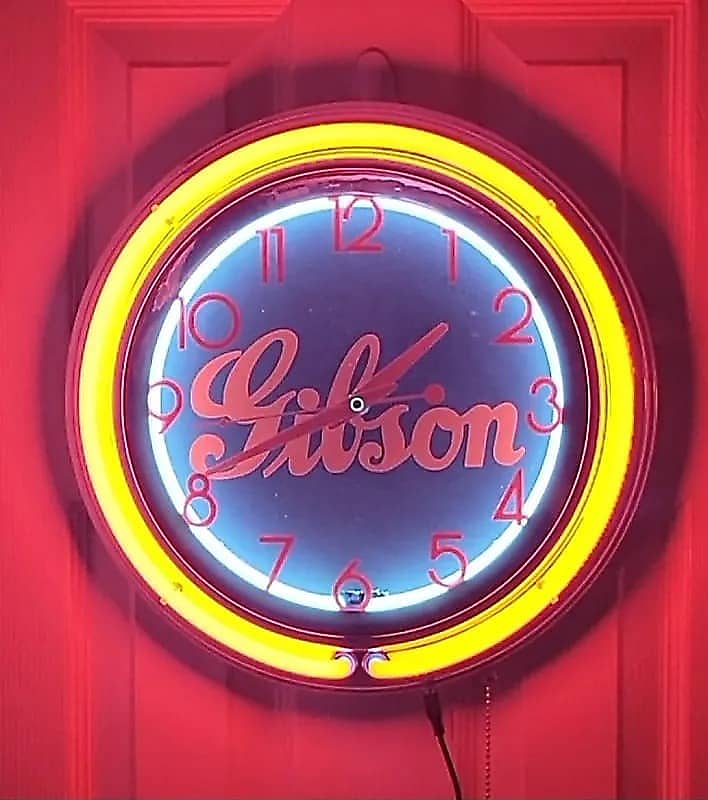
Locate an element on the screen. This screenshot has width=708, height=800. clock seconds hand is located at coordinates (294, 413).